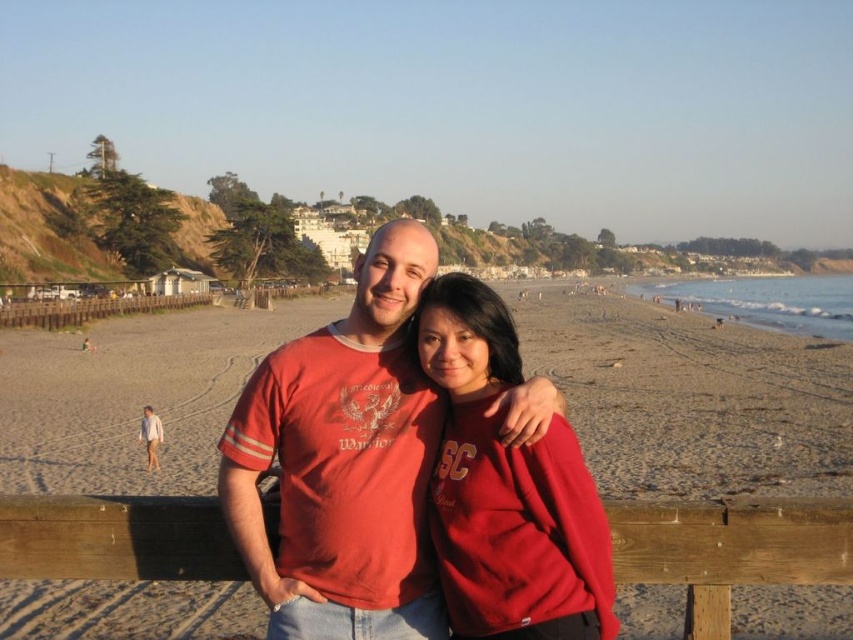
Question: Is matte red t-shirt at center to the right of matte red sweatshirt at center from the viewer's perspective?

Choices:
 (A) no
 (B) yes

Answer: (A)

Question: Considering the relative positions of matte red shirt at center and matte red t-shirt at center in the image provided, where is matte red shirt at center located with respect to matte red t-shirt at center?

Choices:
 (A) below
 (B) above

Answer: (B)

Question: Which object is positioned closest to the matte red shirt at center?

Choices:
 (A) wooden at lower center
 (B) matte red sweatshirt at center
 (C) matte red t-shirt at center

Answer: (C)

Question: Among these objects, which one is nearest to the camera?

Choices:
 (A) wooden at lower center
 (B) matte red shirt at center
 (C) matte red t-shirt at center

Answer: (A)

Question: Which point is closer to the camera?

Choices:
 (A) matte red shirt at center
 (B) matte red sweatshirt at center
 (C) wooden at lower center
 (D) matte red t-shirt at center

Answer: (C)

Question: Is matte red shirt at center below matte red t-shirt at center?

Choices:
 (A) no
 (B) yes

Answer: (A)